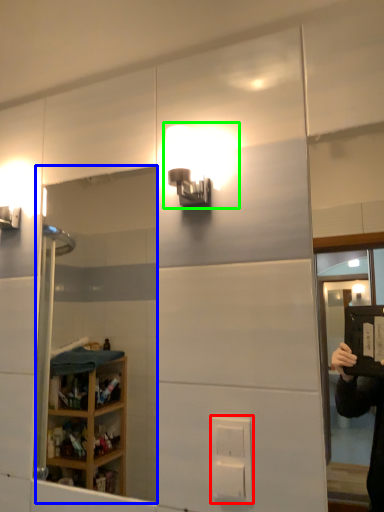
Question: Which object is positioned farthest from electric outlet (highlighted by a red box)? Select from mirror (highlighted by a blue box) and light fixture (highlighted by a green box).

Choices:
 (A) mirror
 (B) light fixture

Answer: (A)